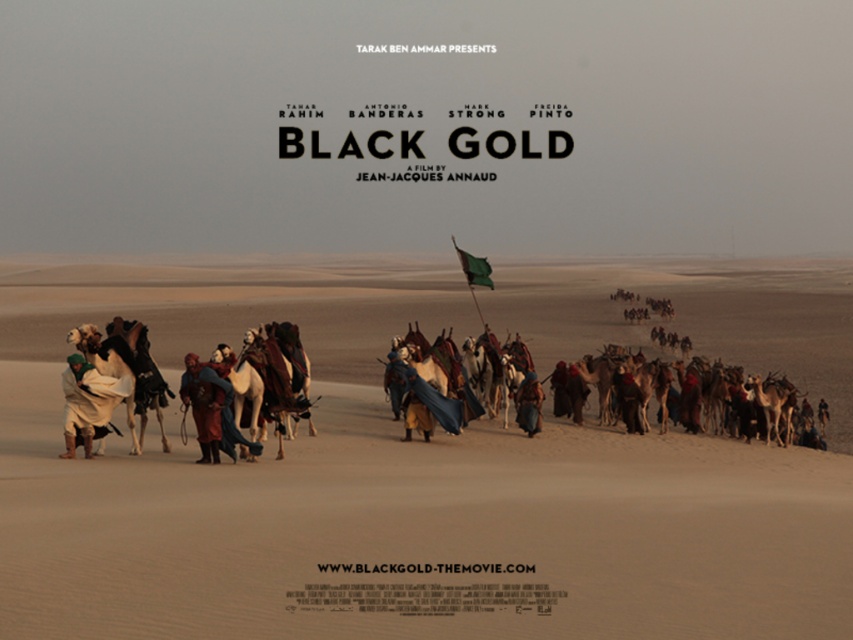
Does brown textured camel at left lie behind blue fabric robe at center?

No, it is in front of blue fabric robe at center.

Which is more to the right, brown textured camel at left or blue fabric robe at center?

blue fabric robe at center is more to the right.

At what (x,y) coordinates should I click in order to perform the action: click on brown textured camel at left. Please return your answer as a coordinate pair (x, y). The height and width of the screenshot is (640, 853). Looking at the image, I should click on (126, 369).

Locate an element on the screen. This screenshot has height=640, width=853. brown textured camel at left is located at coordinates (126, 369).

Is reddish-brown leather armor at center bigger than blue fabric robe at center?

Yes.

Between point (218, 452) and point (534, 381), which one is positioned behind?

The point (534, 381) is more distant.

Is point (216, 461) less distant than point (521, 413)?

Yes, point (216, 461) is closer to viewer.

Identify the location of reddish-brown leather armor at center. (204, 404).

Does brown textured camel at left appear over green fabric flag at center?

Actually, brown textured camel at left is below green fabric flag at center.

Is brown textured camel at left taller than green fabric flag at center?

Incorrect, brown textured camel at left's height is not larger of green fabric flag at center's.

At what (x,y) coordinates should I click in order to perform the action: click on brown textured camel at left. Please return your answer as a coordinate pair (x, y). Looking at the image, I should click on coord(126,369).